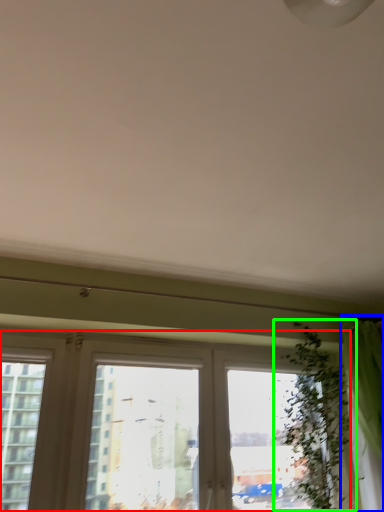
Question: Which object is positioned farthest from window (highlighted by a red box)? Select from curtain (highlighted by a blue box) and vegetation (highlighted by a green box).

Choices:
 (A) curtain
 (B) vegetation

Answer: (A)